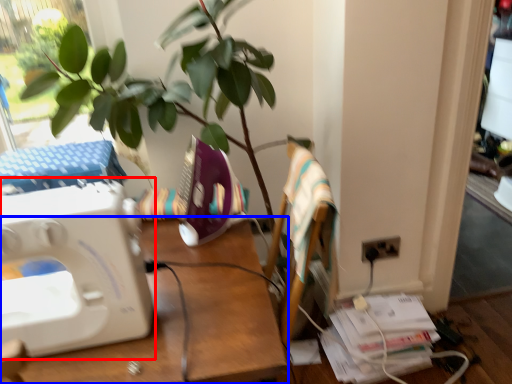
Question: Which object is closer to the camera taking this photo, sewing machine (highlighted by a red box) or desk (highlighted by a blue box)?

Choices:
 (A) sewing machine
 (B) desk

Answer: (B)